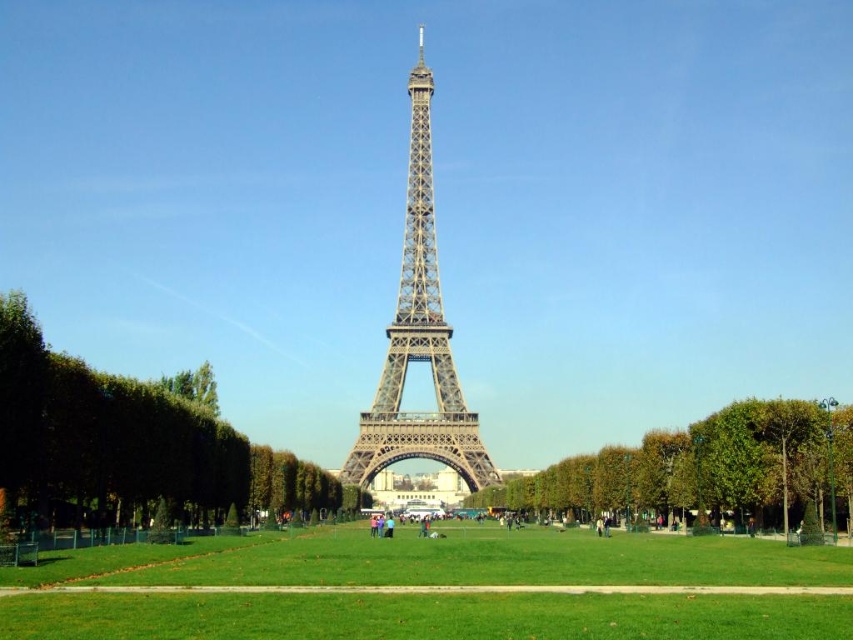
Question: Estimate the real-world distances between objects in this image. Which object is farther from the green leafy tree at center?

Choices:
 (A) metallic silver eiffel tower at center
 (B) green grass at center

Answer: (A)

Question: Which of the following is the closest to the observer?

Choices:
 (A) green leafy tree at center
 (B) metallic silver eiffel tower at center
 (C) green grass at center

Answer: (C)

Question: Does green leafy tree at left have a smaller size compared to metallic silver eiffel tower at center?

Choices:
 (A) yes
 (B) no

Answer: (B)

Question: Is green leafy tree at center behind metallic silver eiffel tower at center?

Choices:
 (A) no
 (B) yes

Answer: (B)

Question: Which object is closer to the camera taking this photo?

Choices:
 (A) green leafy tree at center
 (B) metallic silver eiffel tower at center

Answer: (B)

Question: In this image, where is green leafy tree at left located relative to green leafy tree at center?

Choices:
 (A) above
 (B) below

Answer: (A)